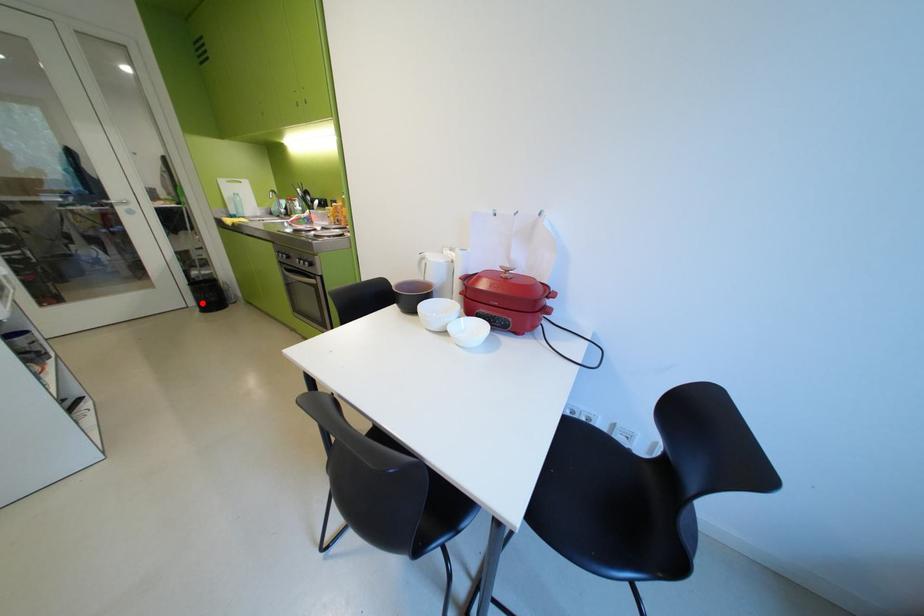
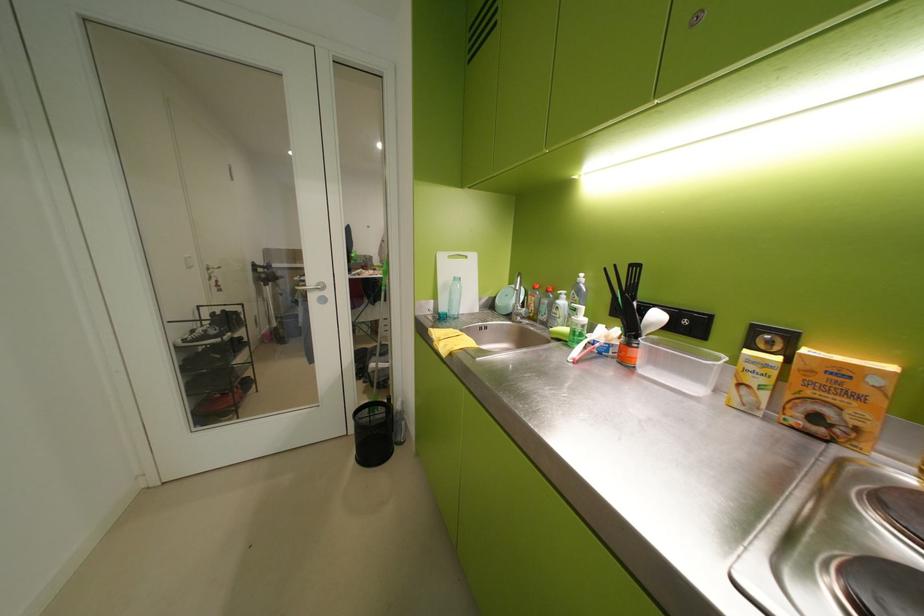
Locate, in the second image, the point that corresponds to the highlighted location in the first image.

(363, 432)